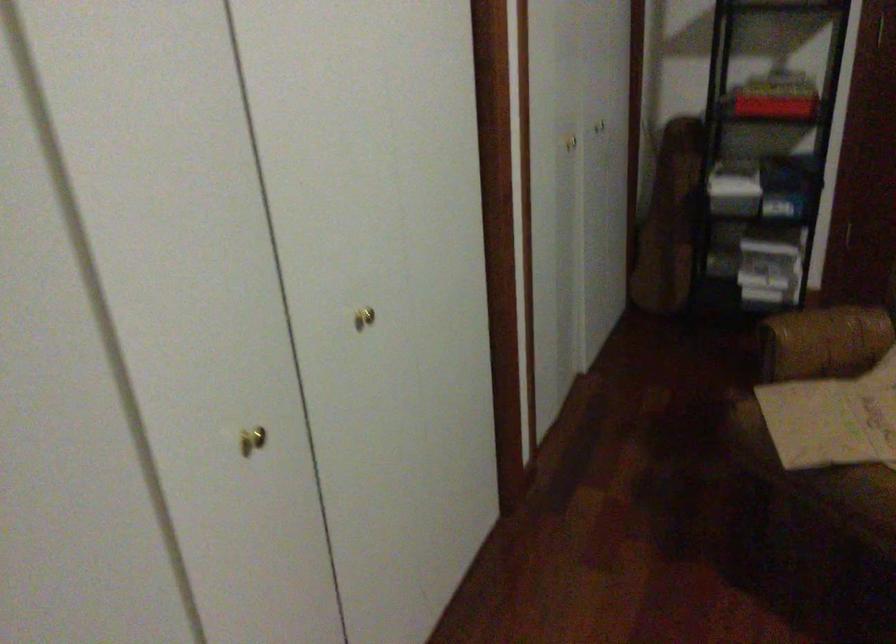
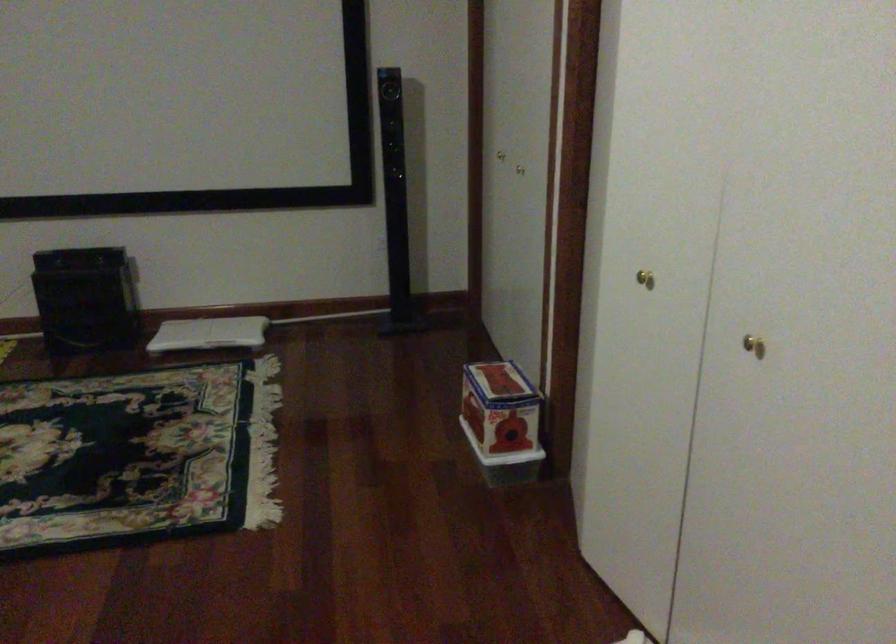
Find the pixel in the second image that matches the point at 252,451 in the first image.

(644, 279)